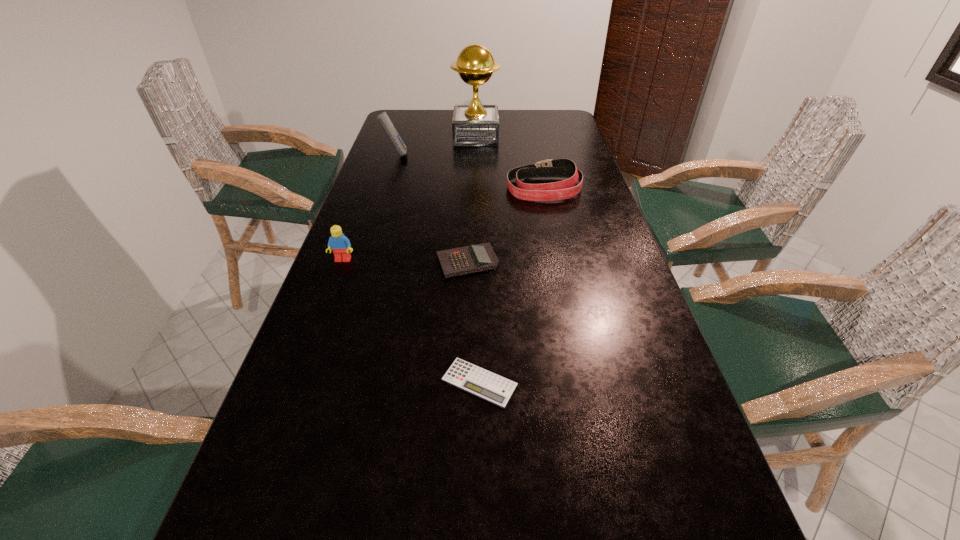
Locate an element on the screen. Image resolution: width=960 pixels, height=540 pixels. the tallest object is located at coordinates (473, 125).

Identify the location of award. The width and height of the screenshot is (960, 540). (473, 125).

The image size is (960, 540). Find the location of `the leftmost calculator`. the leftmost calculator is located at coordinates (383, 118).

Where is `the second farthest object`? The image size is (960, 540). the second farthest object is located at coordinates (383, 118).

Find the location of a particular element. The height and width of the screenshot is (540, 960). Lego is located at coordinates (339, 243).

Identify the location of the third shortest object. (565, 168).

The height and width of the screenshot is (540, 960). Identify the location of the third farthest object. point(565,168).

Image resolution: width=960 pixels, height=540 pixels. Find the location of `the fifth tallest object`. the fifth tallest object is located at coordinates (475, 258).

Where is `the second nearest calculator`? The height and width of the screenshot is (540, 960). the second nearest calculator is located at coordinates (475, 258).

Identify the location of the nearest object. This screenshot has height=540, width=960. coord(473,379).